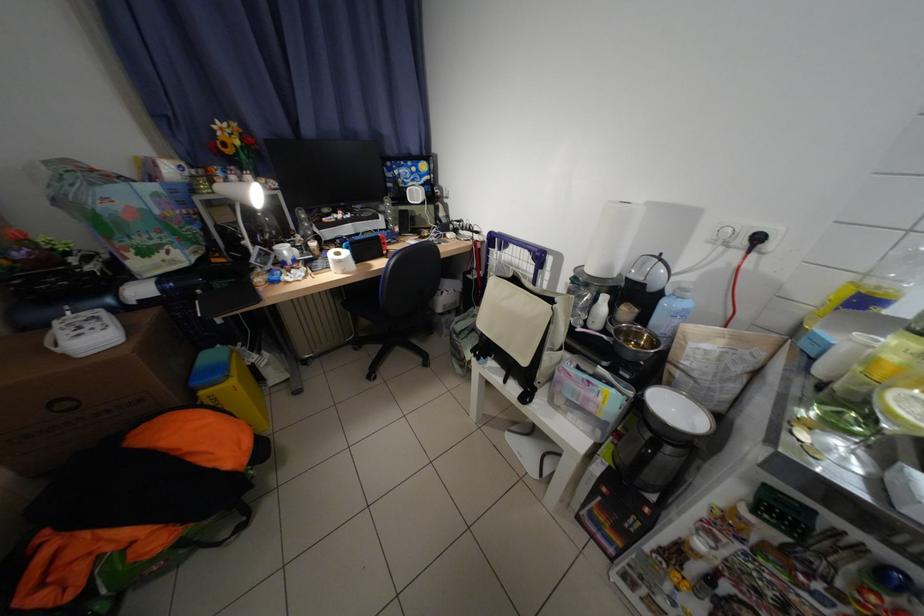
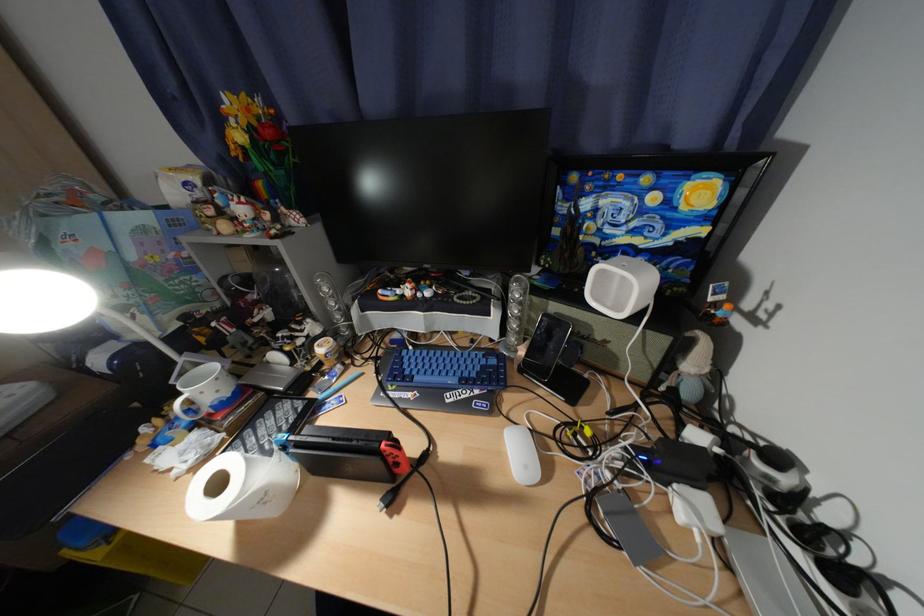
The point at (395, 245) is marked in the first image. Where is the corresponding point in the second image?

(408, 466)